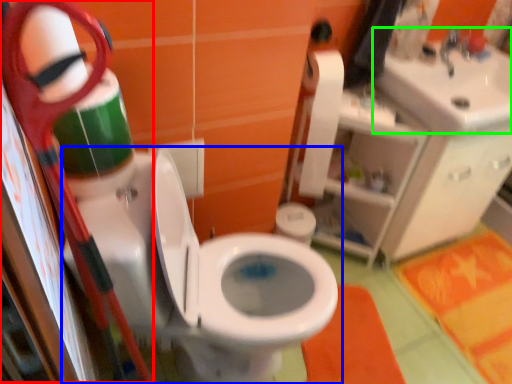
Question: Which object is the farthest from scissors (highlighted by a red box)? Choose among these: toilet (highlighted by a blue box) or sink (highlighted by a green box).

Choices:
 (A) toilet
 (B) sink

Answer: (B)